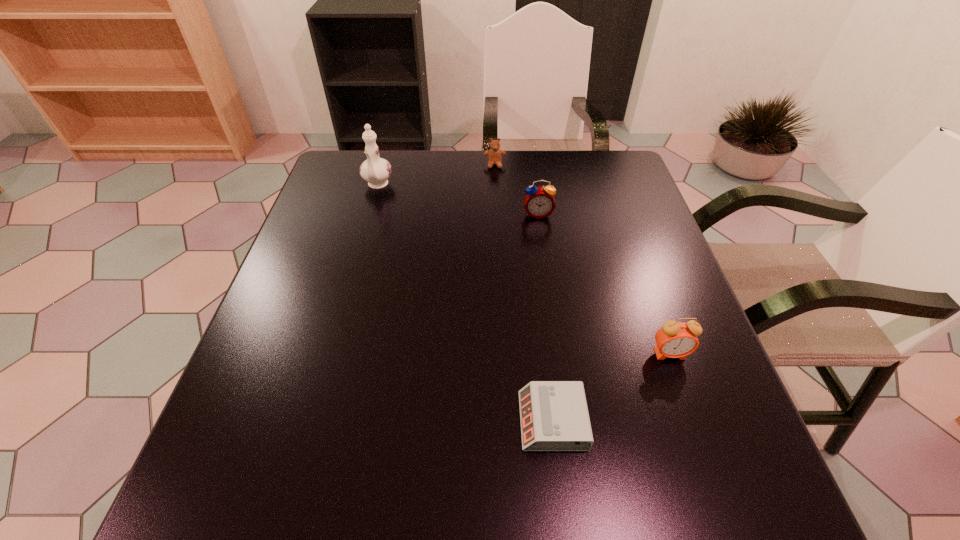
You are a GUI agent. You are given a task and a screenshot of the screen. Output one action in this format:
    pyautogui.click(x=<x>, y=<y>)
    Task: Click on the free space located on the front-facing side of the third farthest object
    Image resolution: width=960 pixels, height=540 pixels.
    Given the screenshot: What is the action you would take?
    pyautogui.click(x=541, y=237)

You are a GUI agent. You are given a task and a screenshot of the screen. Output one action in this format:
    pyautogui.click(x=<x>, y=<y>)
    Task: Click on the vacant space located 0.190m on the face of the rightmost alarm clock
    
    Given the screenshot: What is the action you would take?
    pyautogui.click(x=708, y=462)

This screenshot has height=540, width=960. What are the coordinates of `vacant position located on the face of the second shortest object` in the screenshot? It's located at (495, 187).

Find the location of `vacant region located on the back of the shortest alarm clock`. vacant region located on the back of the shortest alarm clock is located at coordinates (539, 308).

The width and height of the screenshot is (960, 540). I want to click on chinaware that is at the far edge, so click(x=375, y=170).

Locate an element on the screen. This screenshot has width=960, height=540. teddy bear at the far edge is located at coordinates (494, 154).

Where is `object that is positioned at the left edge`? Image resolution: width=960 pixels, height=540 pixels. object that is positioned at the left edge is located at coordinates (375, 170).

The height and width of the screenshot is (540, 960). In order to click on object that is at the right edge in this screenshot , I will do `click(675, 339)`.

Identify the location of object that is at the far left corner. This screenshot has height=540, width=960. (375, 170).

You are a GUI agent. You are given a task and a screenshot of the screen. Output one action in this format:
    pyautogui.click(x=<x>, y=<y>)
    Task: Click on the vacant area at the far edge of the desktop
    This screenshot has height=540, width=960.
    Given the screenshot: What is the action you would take?
    pyautogui.click(x=408, y=187)